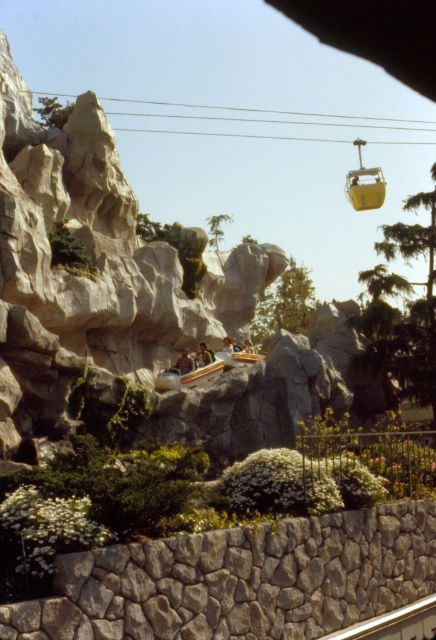
Question: Is the position of smooth gray rock at center more distant than that of brown leather jacket at center?

Choices:
 (A) no
 (B) yes

Answer: (A)

Question: Does gray rough stone wall at lower center appear over smooth brown leather jacket at center?

Choices:
 (A) no
 (B) yes

Answer: (A)

Question: Estimate the real-world distances between objects in this image. Which object is farther from the yellow matte ski lift at upper right?

Choices:
 (A) gray rough stone wall at lower center
 (B) smooth brown leather jacket at center
 (C) brown leather jacket at center
 (D) orange glossy roller coaster at center

Answer: (A)

Question: Which object is farther from the camera taking this photo?

Choices:
 (A) gray rough stone wall at lower center
 (B) brown leather jacket at center

Answer: (B)

Question: Which object is closer to the camera taking this photo?

Choices:
 (A) smooth brown leather jacket at center
 (B) smooth gray rock at center
 (C) yellow matte ski lift at upper right

Answer: (B)

Question: Does smooth brown leather jacket at center appear over brown leather jacket at center?

Choices:
 (A) no
 (B) yes

Answer: (A)